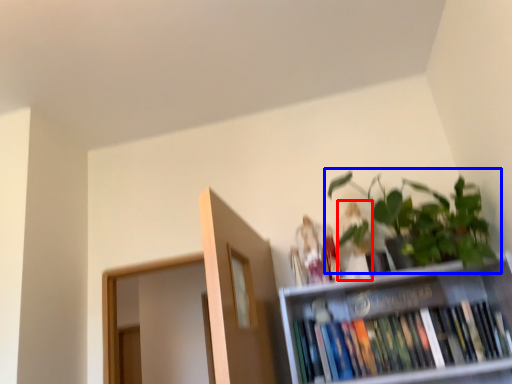
Question: Which object appears closest to the camera in this image, toy (highlighted by a red box) or houseplant (highlighted by a blue box)?

Choices:
 (A) toy
 (B) houseplant

Answer: (B)